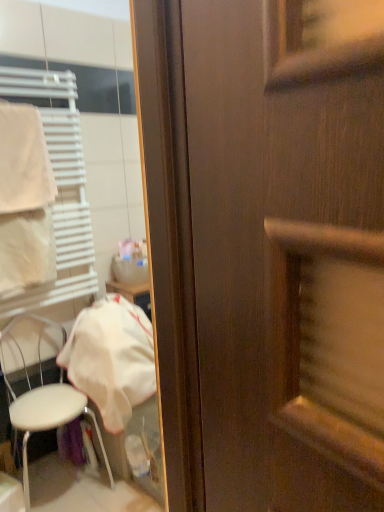
Question: Is white plastic chair at lower left at the right side of white fabric at left?

Choices:
 (A) no
 (B) yes

Answer: (A)

Question: From a real-world perspective, is white plastic chair at lower left on white fabric at left?

Choices:
 (A) yes
 (B) no

Answer: (B)

Question: From the image's perspective, is white plastic chair at lower left located beneath white fabric at left?

Choices:
 (A) no
 (B) yes

Answer: (B)

Question: From the image's perspective, is white plastic chair at lower left located above white fabric at left?

Choices:
 (A) no
 (B) yes

Answer: (A)

Question: Does white plastic chair at lower left have a lesser width compared to white fabric at left?

Choices:
 (A) yes
 (B) no

Answer: (A)

Question: Is point (1, 103) closer or farther from the camera than point (76, 393)?

Choices:
 (A) farther
 (B) closer

Answer: (B)

Question: Is white fabric towel at left wider or thinner than white plastic chair at lower left?

Choices:
 (A) wide
 (B) thin

Answer: (B)

Question: Looking at the image, does white fabric towel at left seem bigger or smaller compared to white plastic chair at lower left?

Choices:
 (A) big
 (B) small

Answer: (B)

Question: From a real-world perspective, is white fabric towel at left positioned above or below white plastic chair at lower left?

Choices:
 (A) below
 (B) above

Answer: (B)

Question: Which is correct: white plastic chair at lower left is inside white fabric towel at left, or outside of it?

Choices:
 (A) outside
 (B) inside

Answer: (A)

Question: Considering the positions of point (109, 475) and point (52, 186), is point (109, 475) closer or farther from the camera than point (52, 186)?

Choices:
 (A) closer
 (B) farther

Answer: (B)

Question: Relative to white fabric towel at left, is white plastic chair at lower left in front or behind?

Choices:
 (A) front
 (B) behind

Answer: (A)

Question: Considering the positions of white plastic chair at lower left and white fabric towel at left in the image, is white plastic chair at lower left taller or shorter than white fabric towel at left?

Choices:
 (A) short
 (B) tall

Answer: (B)

Question: Considering the positions of point (72, 273) and point (67, 370), is point (72, 273) closer or farther from the camera than point (67, 370)?

Choices:
 (A) farther
 (B) closer

Answer: (A)

Question: In terms of size, does white plastic towel rack at left appear bigger or smaller than white fabric at left?

Choices:
 (A) big
 (B) small

Answer: (B)